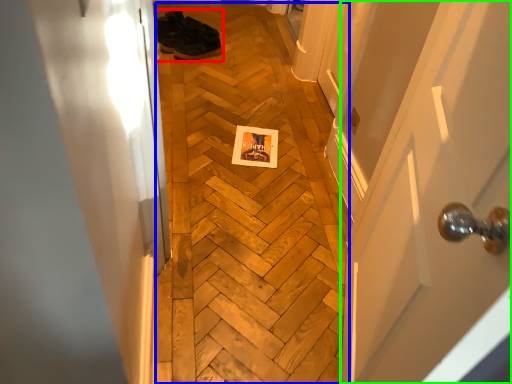
Question: Which is farther away from footwear (highlighted by a red box)? plywood (highlighted by a blue box) or door (highlighted by a green box)?

Choices:
 (A) plywood
 (B) door

Answer: (B)